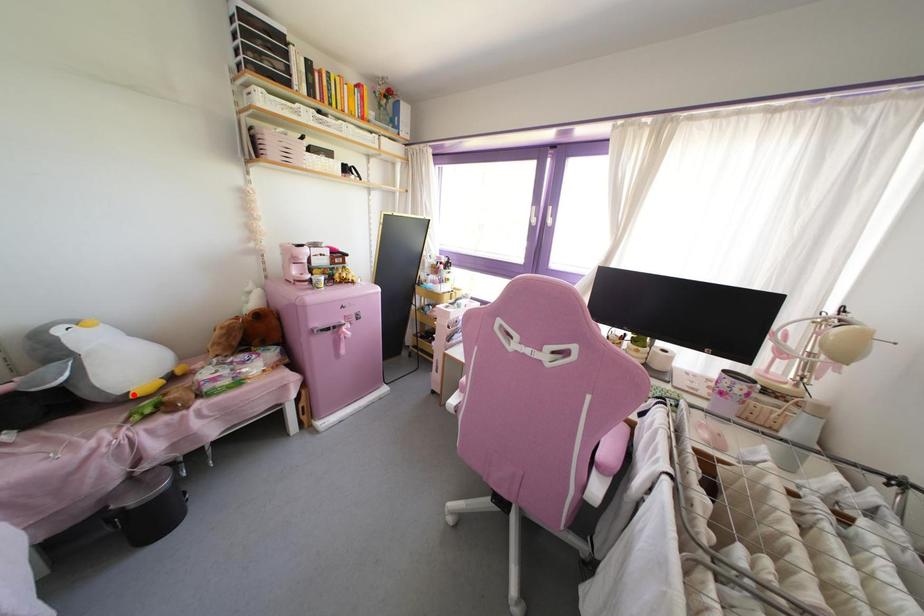
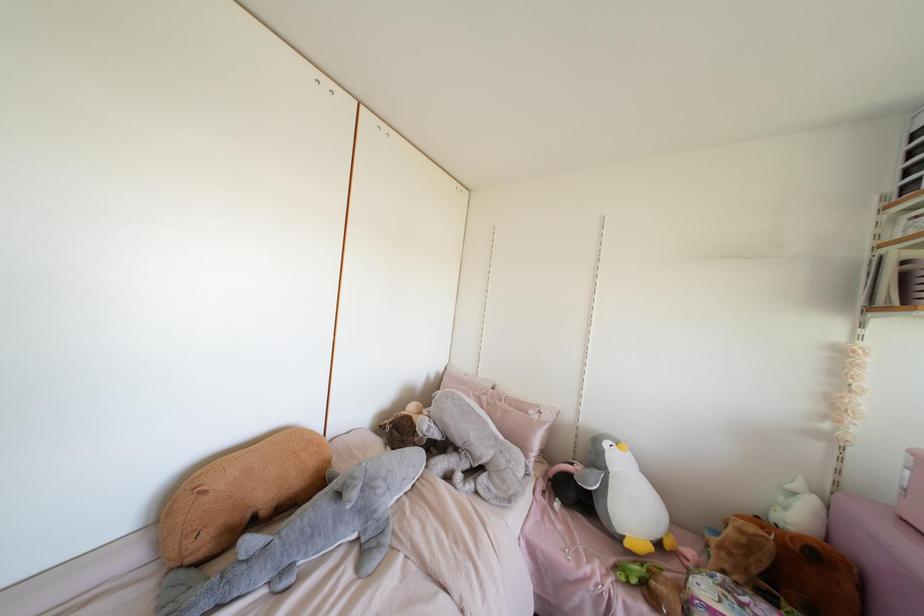
Find the pixel in the second image that matches the highlighted location in the first image.

(626, 544)